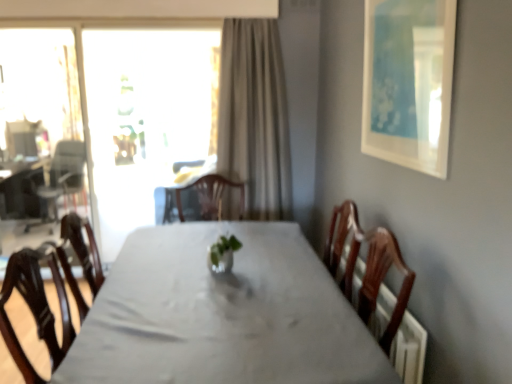
Question: Does matte black armchair at left come in front of white glossy table at center?

Choices:
 (A) yes
 (B) no

Answer: (B)

Question: Is matte black armchair at left wider than white glossy table at center?

Choices:
 (A) no
 (B) yes

Answer: (A)

Question: Considering the relative sizes of matte black armchair at left and white glossy table at center in the image provided, is matte black armchair at left bigger than white glossy table at center?

Choices:
 (A) no
 (B) yes

Answer: (A)

Question: From a real-world perspective, is matte black armchair at left positioned under white glossy table at center based on gravity?

Choices:
 (A) yes
 (B) no

Answer: (B)

Question: Can you see matte black armchair at left touching white glossy table at center?

Choices:
 (A) yes
 (B) no

Answer: (B)

Question: Does matte black armchair at left have a smaller size compared to white glossy table at center?

Choices:
 (A) yes
 (B) no

Answer: (A)

Question: Does transparent glass screen door at left have a lesser width compared to matte black armchair at left?

Choices:
 (A) yes
 (B) no

Answer: (A)

Question: Is transparent glass screen door at left wider than matte black armchair at left?

Choices:
 (A) yes
 (B) no

Answer: (B)

Question: Is transparent glass screen door at left oriented towards matte black armchair at left?

Choices:
 (A) no
 (B) yes

Answer: (A)

Question: From a real-world perspective, is transparent glass screen door at left under matte black armchair at left?

Choices:
 (A) yes
 (B) no

Answer: (B)

Question: Is transparent glass screen door at left looking in the opposite direction of matte black armchair at left?

Choices:
 (A) yes
 (B) no

Answer: (A)

Question: From the image's perspective, is transparent glass screen door at left over matte black armchair at left?

Choices:
 (A) yes
 (B) no

Answer: (A)

Question: From a real-world perspective, is transparent glass screen door at left located higher than transparent glass window at upper left?

Choices:
 (A) no
 (B) yes

Answer: (A)